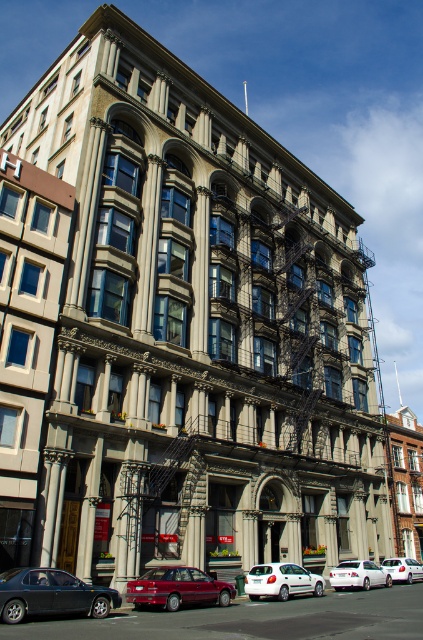
Question: Is white matte sedan at center bigger than silver metallic hatchback at center?

Choices:
 (A) yes
 (B) no

Answer: (A)

Question: Which is nearer to the white matte sedan at center?

Choices:
 (A) metallic red sedan at center
 (B) silver metallic hatchback at center
 (C) matte black sedan at lower left
 (D) white matte hatchback at center

Answer: (B)

Question: Does metallic red sedan at center have a larger size compared to white matte sedan at center?

Choices:
 (A) yes
 (B) no

Answer: (B)

Question: Does matte black sedan at lower left have a larger size compared to white matte hatchback at center?

Choices:
 (A) yes
 (B) no

Answer: (B)

Question: Which is nearer to the matte black sedan at lower left?

Choices:
 (A) silver metallic hatchback at center
 (B) white matte sedan at center

Answer: (B)

Question: Which object is positioned closest to the silver metallic hatchback at center?

Choices:
 (A) metallic red sedan at center
 (B) matte black sedan at lower left
 (C) white matte hatchback at center

Answer: (C)